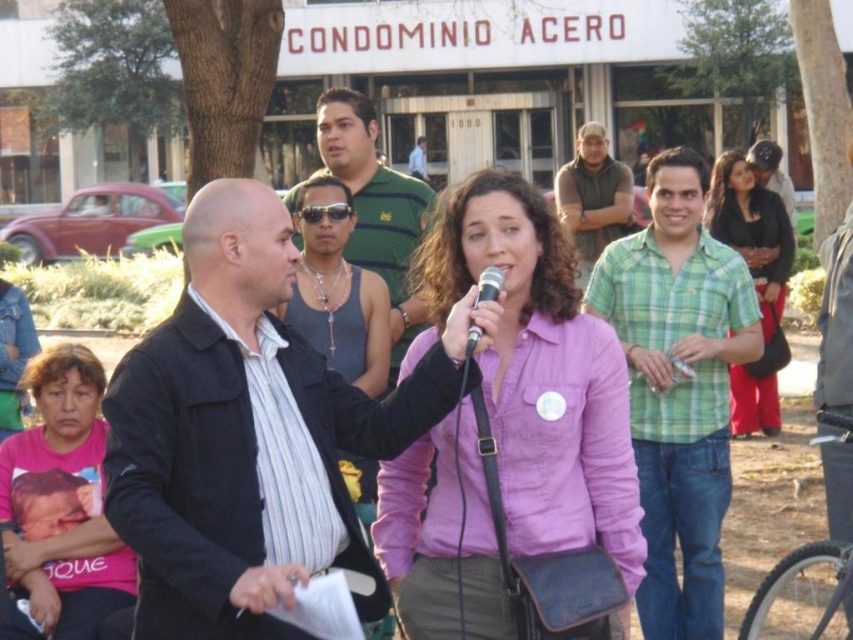
Question: Which object is closer to the camera taking this photo?

Choices:
 (A) pink fabric shirt at lower left
 (B) green plaid shirt at center
 (C) matte green shirt at right
 (D) matte gray tank top at center

Answer: (A)

Question: Can you confirm if black leather jacket at center is positioned below matte gray tank top at center?

Choices:
 (A) no
 (B) yes

Answer: (B)

Question: Which object is farther from the camera taking this photo?

Choices:
 (A) pink cotton shirt at center
 (B) green striped tank top at center
 (C) metallic silver microphone at center

Answer: (B)

Question: Can you confirm if black leather jacket at center is positioned below green plaid shirt at center?

Choices:
 (A) no
 (B) yes

Answer: (B)

Question: Does green plaid shirt at center have a larger size compared to green striped tank top at center?

Choices:
 (A) yes
 (B) no

Answer: (B)

Question: Based on their relative distances, which object is nearer to the matte gray tank top at center?

Choices:
 (A) brown leather jacket at center
 (B) pink cotton shirt at center

Answer: (B)